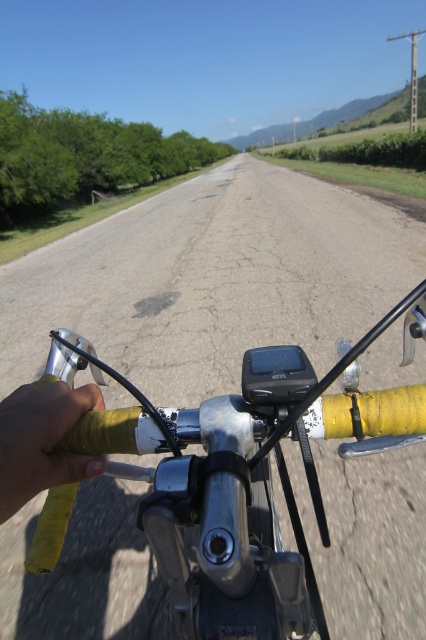
Is yellow matte handlebar at center taller than yellow matte handlebar grip at lower left?

Yes.

How distant is yellow matte handlebar at center from yellow matte handlebar grip at lower left?

yellow matte handlebar at center is 5.77 inches away from yellow matte handlebar grip at lower left.

Is point (377, 396) closer to viewer compared to point (22, 504)?

No.

The image size is (426, 640). Identify the location of yellow matte handlebar at center. (239, 474).